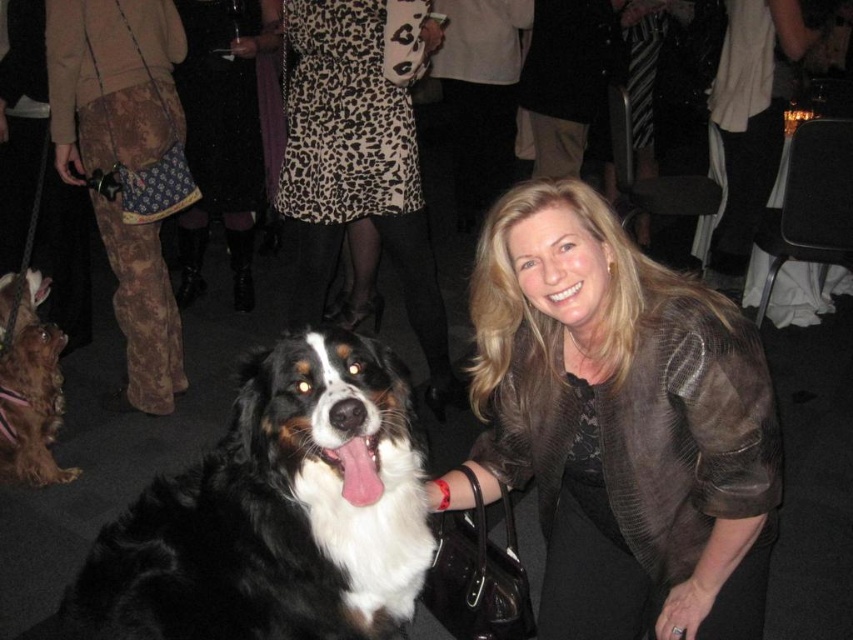
Between leopard print dress at center and shiny brown fur at lower left, which one has more height?

leopard print dress at center

The width and height of the screenshot is (853, 640). I want to click on leopard print dress at center, so click(360, 156).

In the scene shown: Can you confirm if black and white fur dog at center is wider than shiny brown fur at lower left?

Yes, black and white fur dog at center is wider than shiny brown fur at lower left.

Is black and white fur dog at center shorter than shiny brown fur at lower left?

Yes.

What do you see at coordinates (274, 513) in the screenshot? The width and height of the screenshot is (853, 640). I see `black and white fur dog at center` at bounding box center [274, 513].

Locate an element on the screen. This screenshot has width=853, height=640. black and white fur dog at center is located at coordinates (274, 513).

Is brown leather jacket at center above black and white fur dog at center?

Correct, brown leather jacket at center is located above black and white fur dog at center.

Image resolution: width=853 pixels, height=640 pixels. I want to click on brown leather jacket at center, so click(619, 424).